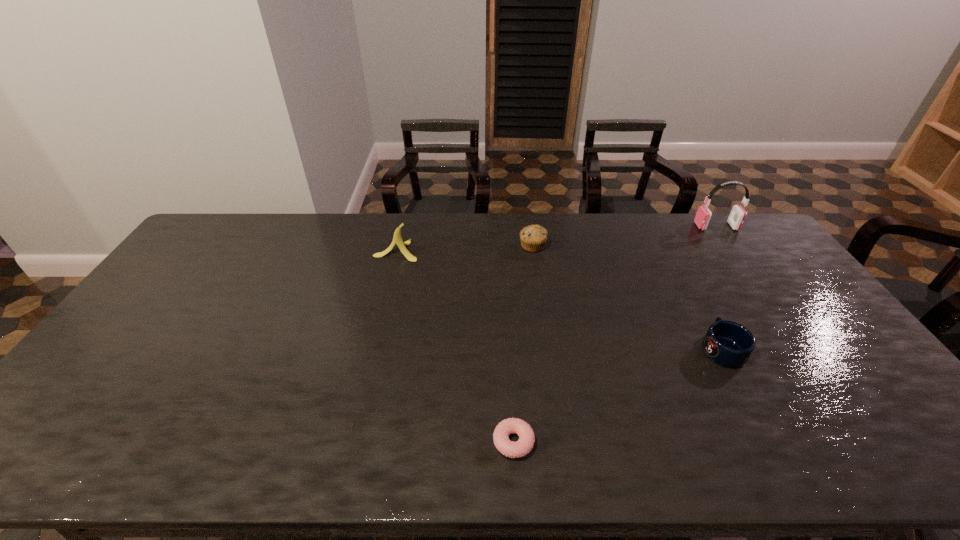
Locate an element on the screen. free space that satisfies the following two spatial constraints: 1. on the back side of the nearest object; 2. on the left side of the muffin is located at coordinates (502, 246).